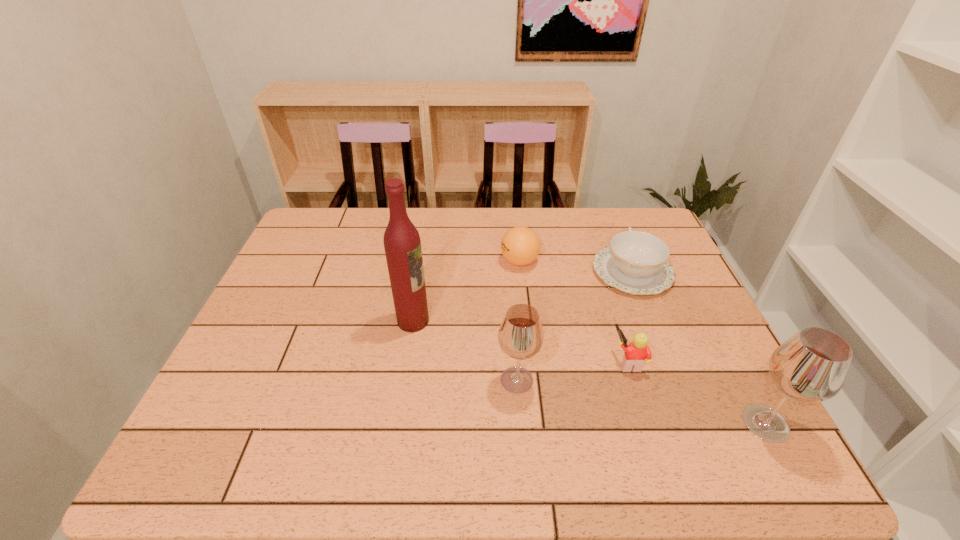
In the image, there is a desktop. At what (x,y) coordinates should I click in order to perform the action: click on free space at the right edge. Please return your answer as a coordinate pair (x, y). The height and width of the screenshot is (540, 960). Looking at the image, I should click on (663, 297).

In the image, there is a desktop. At what (x,y) coordinates should I click in order to perform the action: click on free space at the far left corner. Please return your answer as a coordinate pair (x, y). The image size is (960, 540). Looking at the image, I should click on (318, 220).

Find the location of a particular element. The image size is (960, 540). free space at the near left corner of the desktop is located at coordinates (246, 418).

Where is `vacant space at the far right corner of the desktop`? vacant space at the far right corner of the desktop is located at coordinates (651, 226).

At what (x,y) coordinates should I click in order to perform the action: click on free space that is in between the nearest object and the Lego. Please return your answer as a coordinate pair (x, y). The height and width of the screenshot is (540, 960). Looking at the image, I should click on (697, 393).

Find the location of a particular element. The image size is (960, 540). empty location between the shortest object and the ping-pong ball is located at coordinates tap(576, 267).

The height and width of the screenshot is (540, 960). I want to click on vacant area between the fourth shortest object and the tallest object, so click(465, 350).

Where is `empty space between the nearer wineglass and the leftmost object`? empty space between the nearer wineglass and the leftmost object is located at coordinates (589, 372).

The width and height of the screenshot is (960, 540). I want to click on unoccupied area between the taller wineglass and the farther wineglass, so [641, 402].

In order to click on free spot between the ping-pong ball and the liquor in this screenshot , I will do pyautogui.click(x=467, y=291).